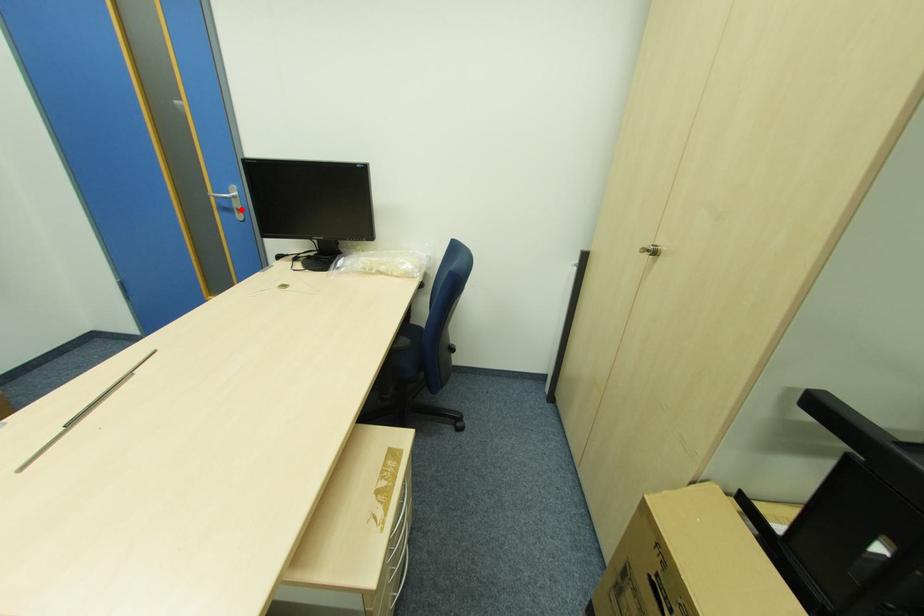
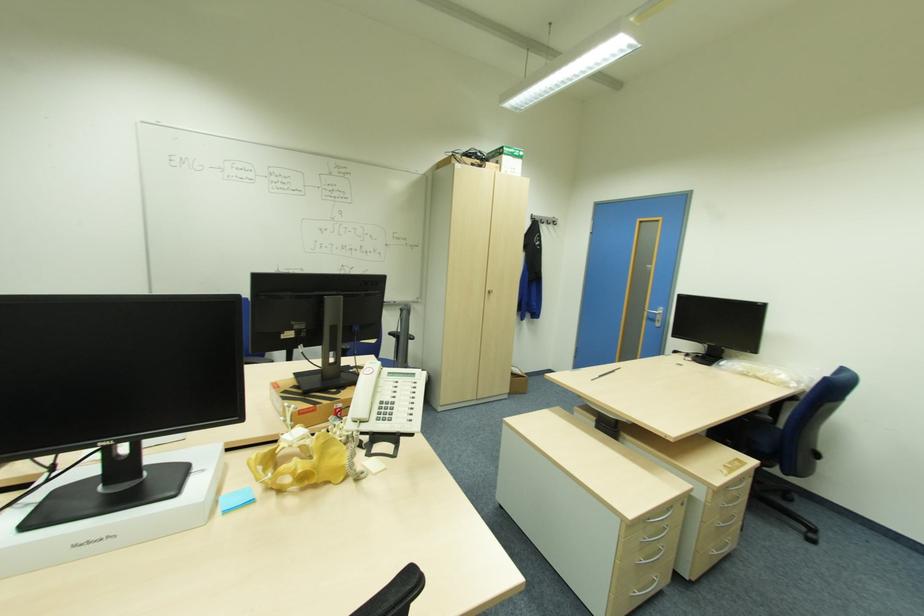
Find the pixel in the second image that matches the highlighted location in the first image.

(661, 321)